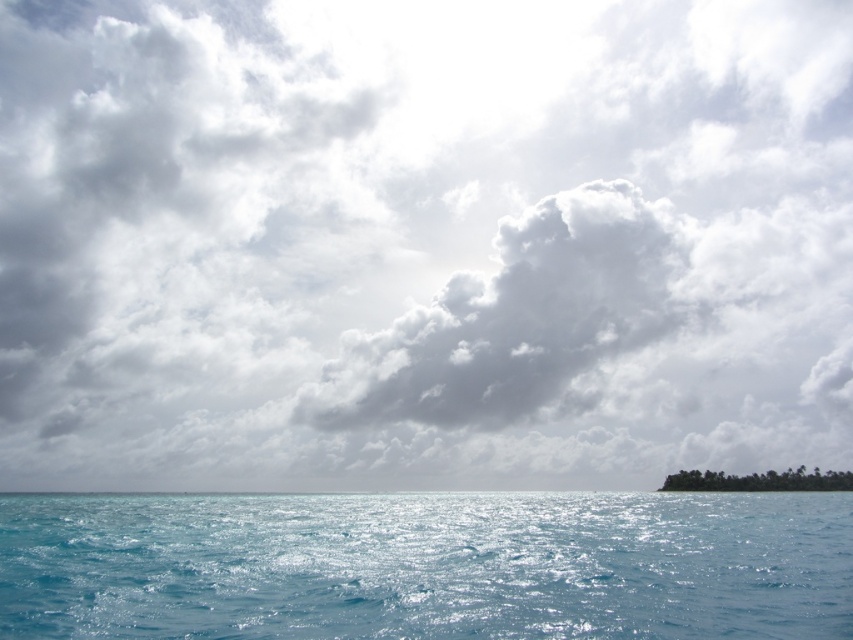
Question: Does clear blue water at lower center appear on the right side of white fluffy cloud at center?

Choices:
 (A) no
 (B) yes

Answer: (A)

Question: Which object appears farthest from the camera in this image?

Choices:
 (A) clear blue water at lower center
 (B) white fluffy cloud at center

Answer: (B)

Question: Can you confirm if clear blue water at lower center is positioned above white fluffy cloud at center?

Choices:
 (A) no
 (B) yes

Answer: (A)

Question: Does clear blue water at lower center appear under white fluffy cloud at center?

Choices:
 (A) no
 (B) yes

Answer: (B)